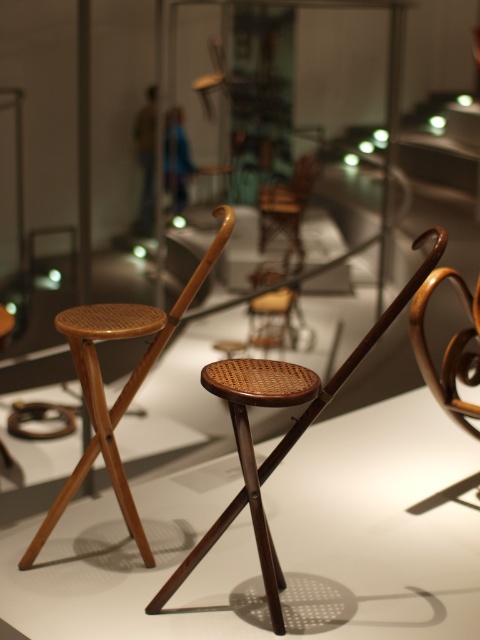
You are an interior designer planning to place a 1.5 meter tall potted plant between the two stools in the image. Which stool, the woven wood folding chair at center or the woven wood chair at center, should the plant be placed closer to in order to maintain visual balance?

The woven wood folding chair at center is taller than the woven wood chair at center. To maintain visual balance, the 1.5 meter tall potted plant should be placed closer to the shorter woven wood chair at center so that the combined height of the plant and stool on that side matches the taller woven wood folding chair at center.